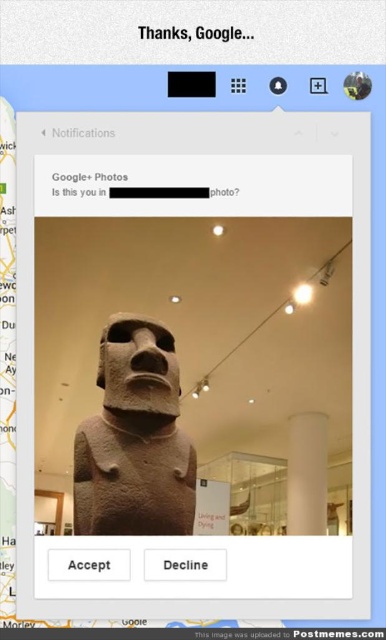
You are a museum security guard standing at the entrance. You need to check the point at coordinates (135,440). Where exactly on the brown stone statue at center should you look?

The point at coordinates (135,440) is on the brown stone statue at center, so you should look at the brown stone statue at center to find that point.

You are a museum security guard standing at the entrance of the room. The entrance is at the bottom left corner of the image. You need to walk to the brown stone statue at center to inspect it. Which direction should you walk first?

Since the brown stone statue at center is located at point (x=135, y=440), you should walk towards the right and then upwards to reach it from the entrance at the bottom left corner.